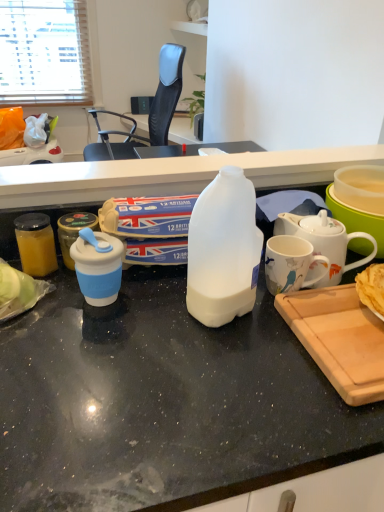
Question: Considering the relative sizes of translucent plastic bowl at right and blue silicone cup at left, arranged as the second kitchen appliance when viewed from the left, in the image provided, is translucent plastic bowl at right bigger than blue silicone cup at left, arranged as the second kitchen appliance when viewed from the left,?

Choices:
 (A) yes
 (B) no

Answer: (A)

Question: From the image's perspective, is translucent plastic bowl at right below blue silicone cup at left, arranged as the second kitchen appliance when viewed from the left?

Choices:
 (A) no
 (B) yes

Answer: (A)

Question: Is translucent plastic bowl at right oriented away from blue silicone cup at left, which ranks as the 1th kitchen appliance in right-to-left order?

Choices:
 (A) yes
 (B) no

Answer: (B)

Question: Considering the relative sizes of translucent plastic bowl at right and blue silicone cup at left, arranged as the second kitchen appliance when viewed from the left, in the image provided, is translucent plastic bowl at right thinner than blue silicone cup at left, arranged as the second kitchen appliance when viewed from the left,?

Choices:
 (A) yes
 (B) no

Answer: (B)

Question: Would you say blue silicone cup at left, arranged as the second kitchen appliance when viewed from the left, is part of translucent plastic bowl at right's contents?

Choices:
 (A) yes
 (B) no

Answer: (B)

Question: Can you see translucent plastic bowl at right touching blue silicone cup at left, which ranks as the 1th kitchen appliance in right-to-left order?

Choices:
 (A) no
 (B) yes

Answer: (A)

Question: Is translucent glass jar at left, the first kitchen appliance from the left, located outside wooden cutting board at lower right?

Choices:
 (A) yes
 (B) no

Answer: (A)

Question: Is wooden cutting board at lower right surrounded by translucent glass jar at left, the first kitchen appliance from the left?

Choices:
 (A) no
 (B) yes

Answer: (A)

Question: Does translucent glass jar at left, the second kitchen appliance in the right-to-left sequence, have a larger size compared to wooden cutting board at lower right?

Choices:
 (A) yes
 (B) no

Answer: (B)

Question: Does translucent glass jar at left, the first kitchen appliance from the left, have a smaller size compared to wooden cutting board at lower right?

Choices:
 (A) no
 (B) yes

Answer: (B)

Question: Does translucent glass jar at left, the second kitchen appliance in the right-to-left sequence, have a lesser height compared to wooden cutting board at lower right?

Choices:
 (A) no
 (B) yes

Answer: (A)

Question: Is translucent glass jar at left, the first kitchen appliance from the left, wider than wooden cutting board at lower right?

Choices:
 (A) yes
 (B) no

Answer: (B)

Question: Is wooden cutting board at lower right aimed at translucent plastic milk bottle at center?

Choices:
 (A) no
 (B) yes

Answer: (B)